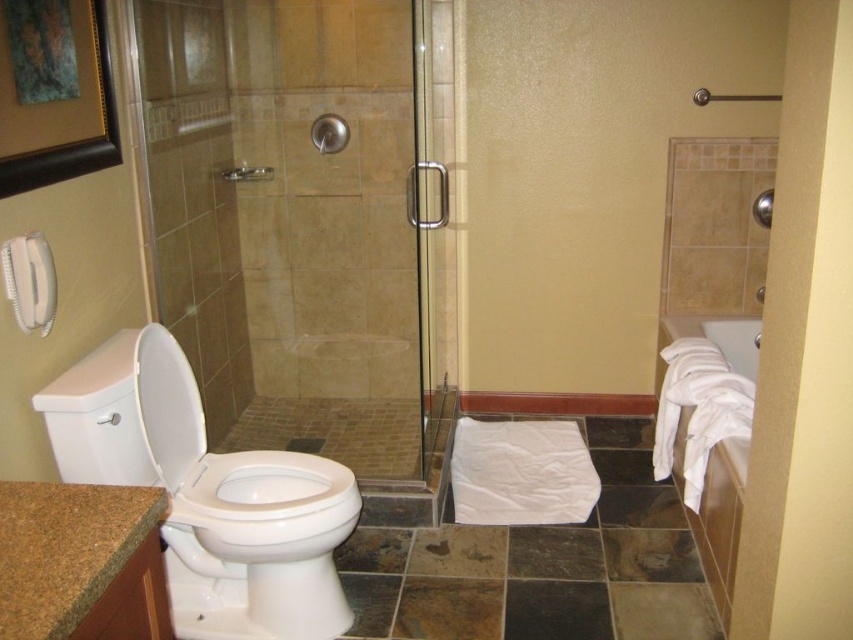
You are a delivery person trying to deliver a package to the bathroom. The package is 18 inches wide. You need to pass through the space between the transparent glass shower door at center and the clear glass shower door at center. Can the package fit through the gap?

The transparent glass shower door at center is 17.59 inches away from the clear glass shower door at center. Since the package is 18 inches wide, it cannot fit through the gap between them as the gap is narrower than the package.

You are standing in the bathroom and need to locate both the transparent glass shower door at center and the clear glass shower door at center. According to the scene description, which one is positioned to the left?

The transparent glass shower door at center is positioned to the left of the clear glass shower door at center.